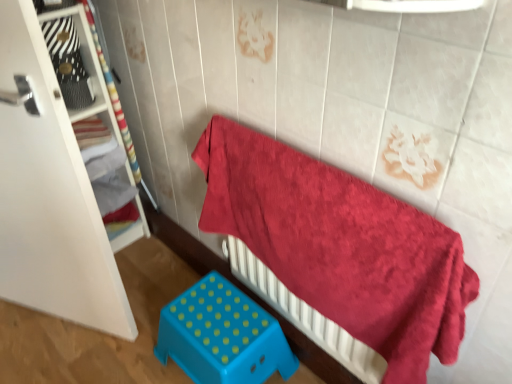
Find the location of `blue plastic stool at lower center`. blue plastic stool at lower center is located at coordinates (222, 336).

Is the position of blue plastic stool at lower center less distant than that of white wood shelf at left?

Yes, blue plastic stool at lower center is closer to the camera.

From a real-world perspective, which object rests below the other?

blue plastic stool at lower center.

From the image's perspective, who appears lower, blue plastic stool at lower center or white wood shelf at left?

blue plastic stool at lower center appears lower in the image.

Where is `bed directly beneath the white wood shelf at left (from a real-world perspective)`? bed directly beneath the white wood shelf at left (from a real-world perspective) is located at coordinates (340, 246).

Considering the points (451, 319) and (99, 106), which point is behind, point (451, 319) or point (99, 106)?

The point (99, 106) is farther.

From a real-world perspective, which is physically below, fluffy red towel at upper right or white wood shelf at left?

In real-world perspective, fluffy red towel at upper right is lower.

Considering the sizes of objects fluffy red towel at upper right and blue plastic stool at lower center in the image provided, who is taller, fluffy red towel at upper right or blue plastic stool at lower center?

fluffy red towel at upper right.

Is the surface of fluffy red towel at upper right in direct contact with blue plastic stool at lower center?

There is a gap between fluffy red towel at upper right and blue plastic stool at lower center.

From the image's perspective, would you say fluffy red towel at upper right is positioned over blue plastic stool at lower center?

Yes, from the image's perspective, fluffy red towel at upper right is over blue plastic stool at lower center.

Is blue plastic stool at lower center located within white wood shelf at left?

That's incorrect, blue plastic stool at lower center is not inside white wood shelf at left.

From the image's perspective, which is above, white wood shelf at left or blue plastic stool at lower center?

From the image's view, white wood shelf at left is above.

Is white wood shelf at left not near blue plastic stool at lower center?

No, white wood shelf at left is in close proximity to blue plastic stool at lower center.

Is white wood shelf at left placed right next to fluffy red towel at upper right?

No.

In the scene shown: Can you confirm if white wood shelf at left is taller than fluffy red towel at upper right?

Correct, white wood shelf at left is much taller as fluffy red towel at upper right.

In the image, is white wood shelf at left on the left side or the right side of fluffy red towel at upper right?

Based on their positions, white wood shelf at left is located to the left of fluffy red towel at upper right.

Can you confirm if white wood shelf at left is wider than fluffy red towel at upper right?

Correct, the width of white wood shelf at left exceeds that of fluffy red towel at upper right.

In the image, is blue plastic stool at lower center on the left side or the right side of fluffy red towel at upper right?

In the image, blue plastic stool at lower center appears on the left side of fluffy red towel at upper right.

Does point (176, 340) come in front of point (217, 143)?

No, (176, 340) is behind (217, 143).

Is blue plastic stool at lower center thinner than fluffy red towel at upper right?

No.

Is blue plastic stool at lower center oriented away from fluffy red towel at upper right?

That's right, blue plastic stool at lower center is facing away from fluffy red towel at upper right.

The height and width of the screenshot is (384, 512). I want to click on furniture below the white wood shelf at left (from a real-world perspective), so pyautogui.click(x=222, y=336).

Find the location of `bed in front of the white wood shelf at left`. bed in front of the white wood shelf at left is located at coordinates [x=340, y=246].

Considering their positions, is white wood shelf at left positioned closer to blue plastic stool at lower center than fluffy red towel at upper right?

Among the two, fluffy red towel at upper right is located nearer to blue plastic stool at lower center.

Considering their positions, is white wood shelf at left positioned closer to fluffy red towel at upper right than blue plastic stool at lower center?

blue plastic stool at lower center is closer to fluffy red towel at upper right.

When comparing their distances from white wood shelf at left, does fluffy red towel at upper right or blue plastic stool at lower center seem further?

fluffy red towel at upper right is positioned further to the anchor white wood shelf at left.

From the image, which object appears to be nearer to fluffy red towel at upper right, blue plastic stool at lower center or white wood shelf at left?

blue plastic stool at lower center.

Which object lies nearer to the anchor point blue plastic stool at lower center, fluffy red towel at upper right or white wood shelf at left?

Based on the image, fluffy red towel at upper right appears to be nearer to blue plastic stool at lower center.

Based on their spatial positions, is blue plastic stool at lower center or fluffy red towel at upper right closer to white wood shelf at left?

Based on the image, blue plastic stool at lower center appears to be nearer to white wood shelf at left.

Where is `furniture between white wood shelf at left and fluffy red towel at upper right from left to right`? furniture between white wood shelf at left and fluffy red towel at upper right from left to right is located at coordinates (222, 336).